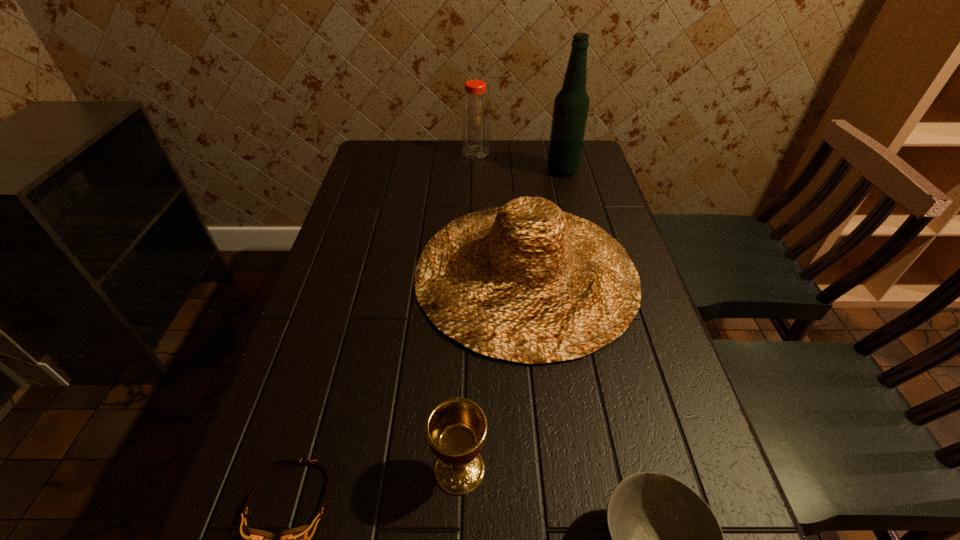
This screenshot has height=540, width=960. Find the location of `alcohol`. alcohol is located at coordinates (571, 105).

Find the location of a particular element. the second farthest object is located at coordinates (571, 105).

In order to click on bottle in this screenshot , I will do `click(475, 112)`.

Locate an element on the screen. Image resolution: width=960 pixels, height=540 pixels. the second tallest object is located at coordinates (475, 112).

Find the location of a particular element. The image size is (960, 540). the third tallest object is located at coordinates (527, 282).

The width and height of the screenshot is (960, 540). Identify the location of sunhat. (527, 282).

The width and height of the screenshot is (960, 540). I want to click on chalice, so click(456, 428).

In order to click on free space located 0.110m on the left of the second farthest object in this screenshot , I will do `click(513, 171)`.

Identify the location of vacant space situated 0.320m on the right of the fifth shortest object. (583, 152).

Locate an element on the screen. Image resolution: width=960 pixels, height=540 pixels. vacant space located on the back of the sunhat is located at coordinates coord(516,189).